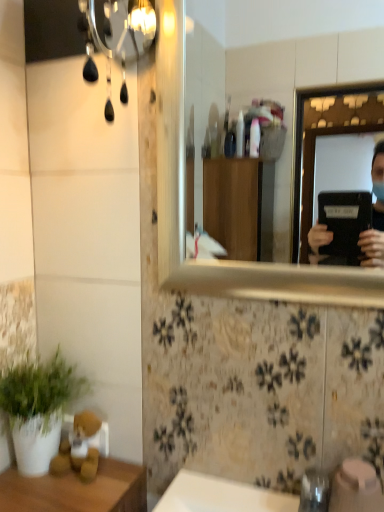
Question: Should I look upward or downward to see metallic silver mirror at upper right?

Choices:
 (A) up
 (B) down

Answer: (A)

Question: Would you say white matte plant at lower left contains metallic silver mirror at upper right?

Choices:
 (A) no
 (B) yes

Answer: (A)

Question: Considering the relative positions of white matte plant at lower left and metallic silver mirror at upper right in the image provided, is white matte plant at lower left to the right of metallic silver mirror at upper right from the viewer's perspective?

Choices:
 (A) no
 (B) yes

Answer: (A)

Question: Can you confirm if white matte plant at lower left is wider than metallic silver mirror at upper right?

Choices:
 (A) no
 (B) yes

Answer: (B)

Question: Considering the relative sizes of white matte plant at lower left and metallic silver mirror at upper right in the image provided, is white matte plant at lower left thinner than metallic silver mirror at upper right?

Choices:
 (A) no
 (B) yes

Answer: (A)

Question: Does white matte plant at lower left lie behind metallic silver mirror at upper right?

Choices:
 (A) no
 (B) yes

Answer: (B)

Question: From a real-world perspective, is white matte plant at lower left over metallic silver mirror at upper right?

Choices:
 (A) yes
 (B) no

Answer: (B)

Question: From a real-world perspective, is metallic silver mirror at upper right beneath white matte plant at lower left?

Choices:
 (A) no
 (B) yes

Answer: (A)

Question: Can you see metallic silver mirror at upper right touching white matte plant at lower left?

Choices:
 (A) yes
 (B) no

Answer: (B)

Question: Can you confirm if metallic silver mirror at upper right is shorter than white matte plant at lower left?

Choices:
 (A) yes
 (B) no

Answer: (B)

Question: Could you tell me if metallic silver mirror at upper right is facing white matte plant at lower left?

Choices:
 (A) no
 (B) yes

Answer: (A)

Question: Is metallic silver mirror at upper right not within white matte plant at lower left?

Choices:
 (A) no
 (B) yes

Answer: (B)

Question: Considering the relative sizes of metallic silver mirror at upper right and white matte plant at lower left in the image provided, is metallic silver mirror at upper right thinner than white matte plant at lower left?

Choices:
 (A) no
 (B) yes

Answer: (B)

Question: Choose the correct answer: Is metallic silver mirror at upper right inside white matte plant at lower left or outside it?

Choices:
 (A) inside
 (B) outside

Answer: (B)